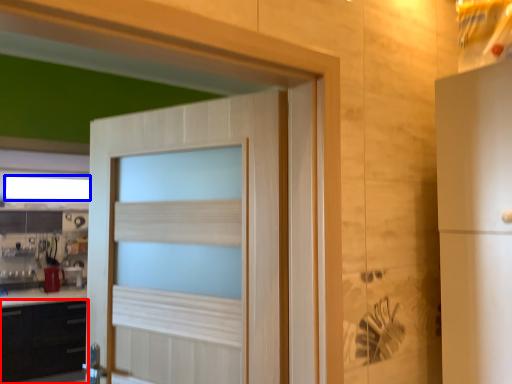
Question: Which object appears farthest to the camera in this image, cabinetry (highlighted by a red box) or window (highlighted by a blue box)?

Choices:
 (A) cabinetry
 (B) window

Answer: (B)